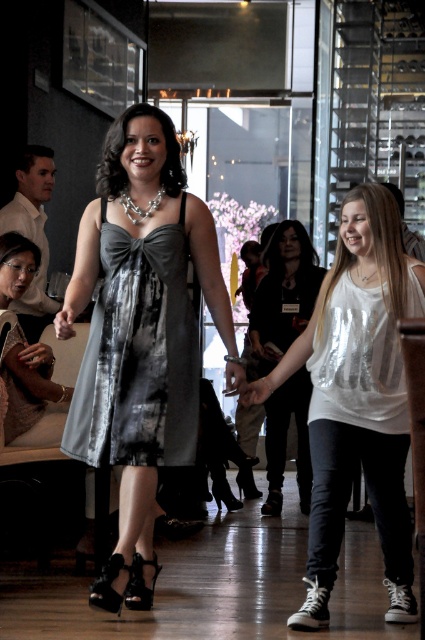
From the picture: Who is higher up, shiny metallic dress at center or black leather sandal at lower center?

Positioned higher is shiny metallic dress at center.

Is shiny metallic dress at center wider than black leather sandal at lower center?

Yes.

Is point (124, 408) positioned behind point (130, 573)?

No, (124, 408) is closer to viewer.

I want to click on shiny metallic dress at center, so click(x=138, y=355).

Is shiny metallic dress at center positioned in front of matte black dress at center?

Yes, shiny metallic dress at center is in front of matte black dress at center.

Between point (124, 390) and point (19, 285), which one is positioned behind?

The point (19, 285) is more distant.

What are the coordinates of `shiny metallic dress at center` in the screenshot? It's located at (138, 355).

Can you confirm if shiny metallic dress at center is positioned to the right of black leather jacket at center?

No, shiny metallic dress at center is not to the right of black leather jacket at center.

Does point (79, 390) come farther from viewer compared to point (291, 404)?

No, (79, 390) is closer to viewer.

This screenshot has height=640, width=425. What are the coordinates of `shiny metallic dress at center` in the screenshot? It's located at (138, 355).